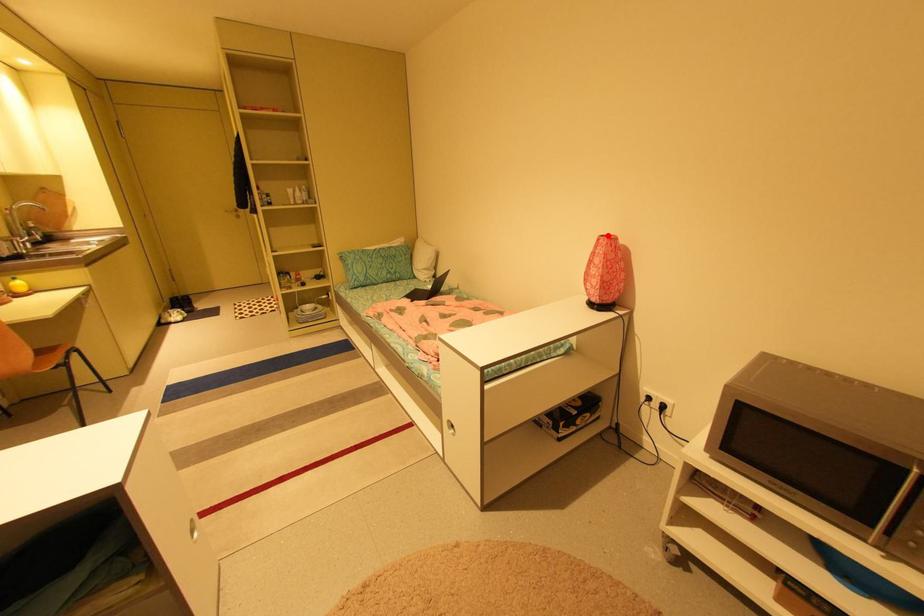
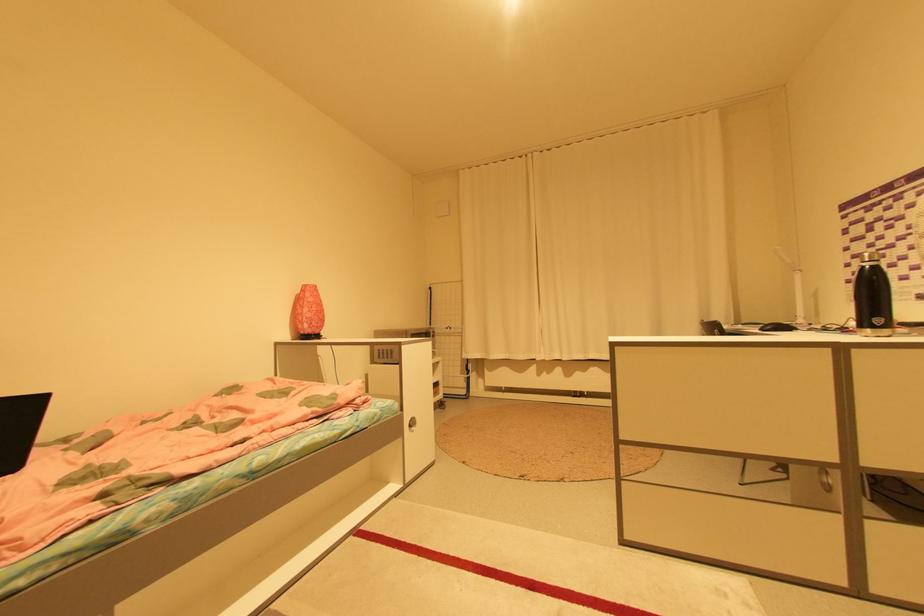
Locate, in the second image, the point that corresponds to the highlighted location in the first image.

(311, 285)